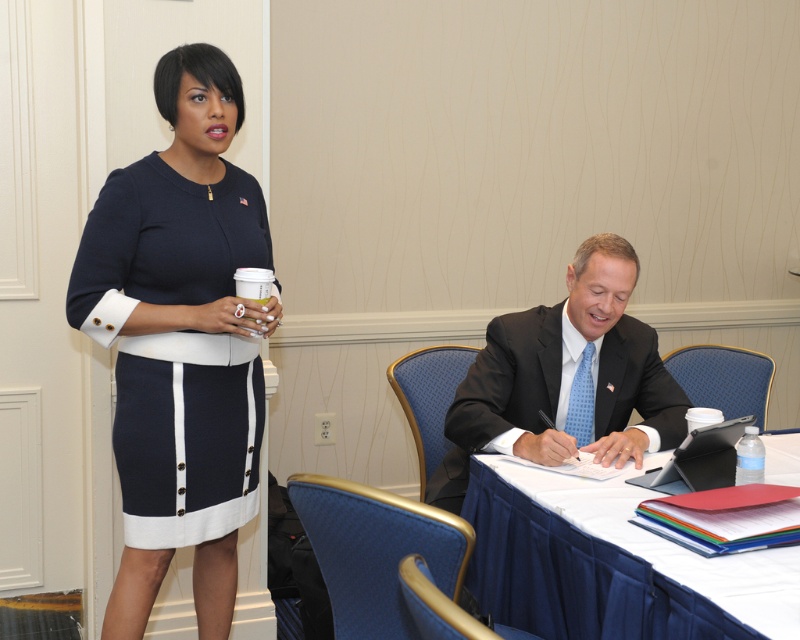
Question: Which object is positioned closest to the dark gray suit at center?

Choices:
 (A) white cloth-covered table at lower right
 (B) navy knit dress at upper left

Answer: (A)

Question: Is navy knit dress at upper left bigger than dark gray suit at center?

Choices:
 (A) no
 (B) yes

Answer: (A)

Question: Can you confirm if white cloth-covered table at lower right is thinner than dark gray suit at center?

Choices:
 (A) yes
 (B) no

Answer: (A)

Question: Which of the following is the closest to the observer?

Choices:
 (A) (598, 627)
 (B) (568, 449)
 (C) (192, 227)

Answer: (A)

Question: Is white cloth-covered table at lower right above dark gray suit at center?

Choices:
 (A) yes
 (B) no

Answer: (B)

Question: Considering the real-world distances, which object is farthest from the white cloth-covered table at lower right?

Choices:
 (A) dark gray suit at center
 (B) navy knit dress at upper left

Answer: (B)